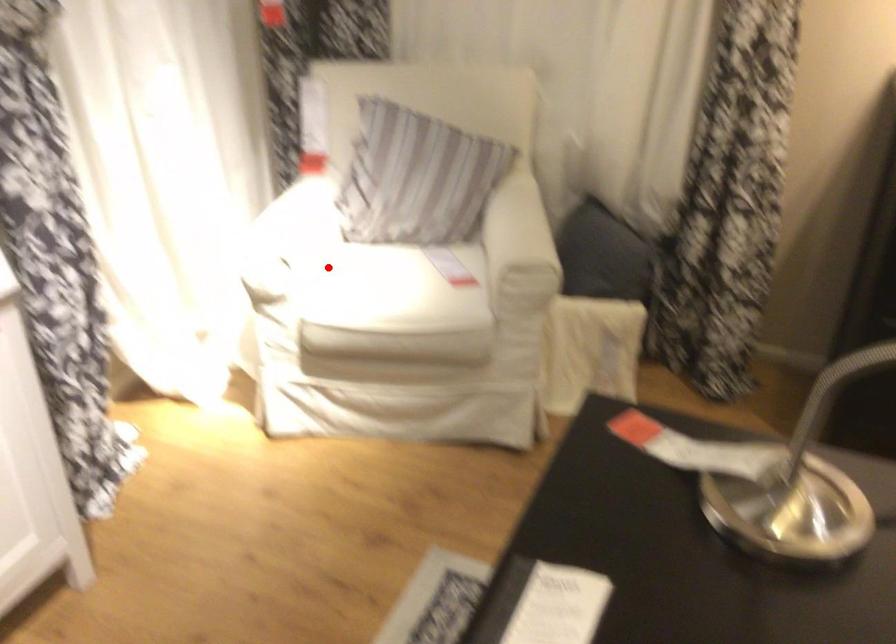
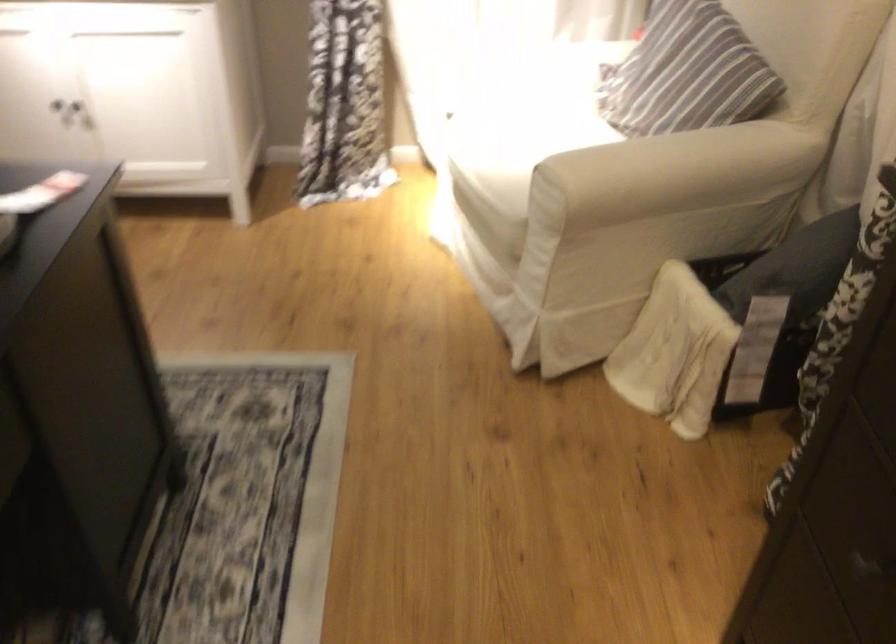
In the second image, find the point that corresponds to the highlighted location in the first image.

(527, 114)